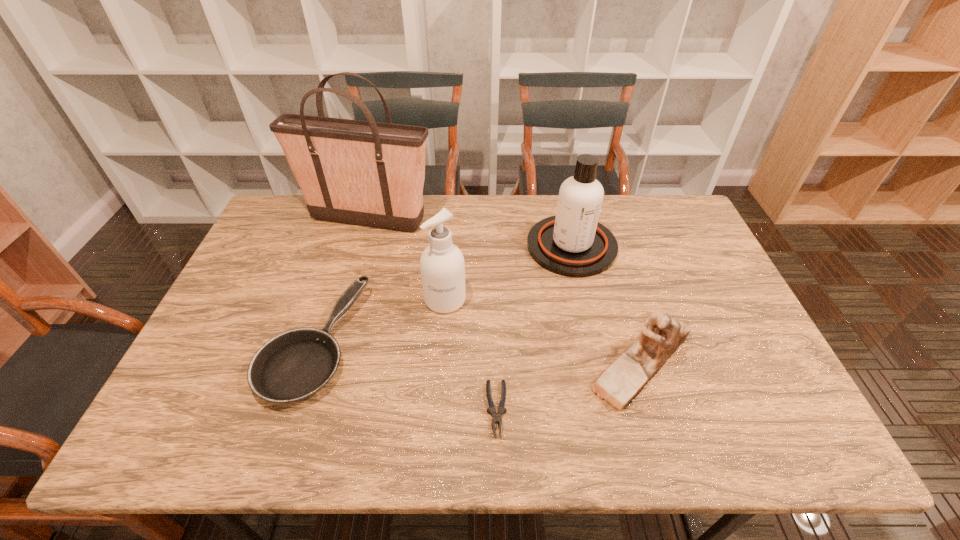
Find the location of a particular element. The height and width of the screenshot is (540, 960). the tallest object is located at coordinates coord(367,173).

This screenshot has height=540, width=960. Identify the location of the right cleansing agent. (573, 243).

This screenshot has height=540, width=960. Find the location of `the left cleansing agent`. the left cleansing agent is located at coordinates (442, 266).

Locate an element on the screen. The height and width of the screenshot is (540, 960). the fourth tallest object is located at coordinates (661, 335).

Where is `the fifth tallest object`? This screenshot has width=960, height=540. the fifth tallest object is located at coordinates (294, 365).

Where is `the shortest object`? This screenshot has height=540, width=960. the shortest object is located at coordinates (497, 416).

This screenshot has width=960, height=540. In order to click on the fourth object from left to right in this screenshot , I will do `click(497, 416)`.

Find the location of `free spot located on the front of the tallest object`. free spot located on the front of the tallest object is located at coordinates (347, 294).

Find the location of a particular element. The image size is (960, 540). free region located 0.300m on the left of the farther cleansing agent is located at coordinates (433, 246).

The image size is (960, 540). I want to click on free point located on the front label of the nearer cleansing agent, so click(440, 368).